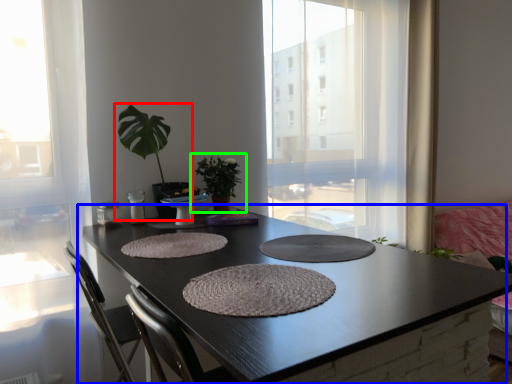
Question: Estimate the real-world distances between objects in this image. Which object is closer to houseplant (highlighted by a red box), coffee table (highlighted by a blue box) or houseplant (highlighted by a green box)?

Choices:
 (A) coffee table
 (B) houseplant

Answer: (B)